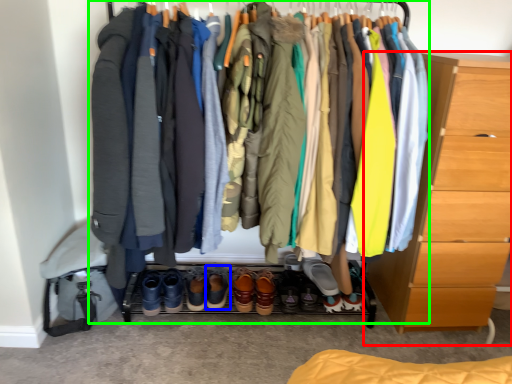
Question: Based on their relative distances, which object is nearer to chest of drawers (highlighted by a red box)? Choose from footwear (highlighted by a blue box) and closet (highlighted by a green box).

Choices:
 (A) footwear
 (B) closet

Answer: (B)